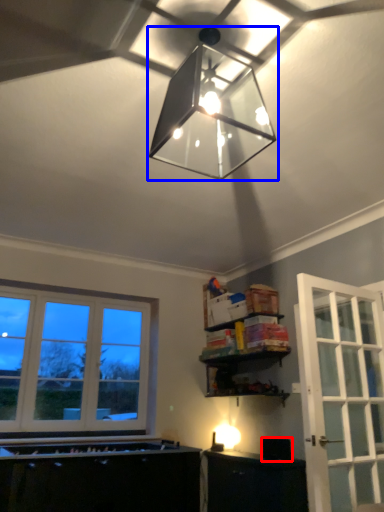
Question: Which object appears closest to the camera in this image, appliance (highlighted by a red box) or lamp (highlighted by a blue box)?

Choices:
 (A) appliance
 (B) lamp

Answer: (B)